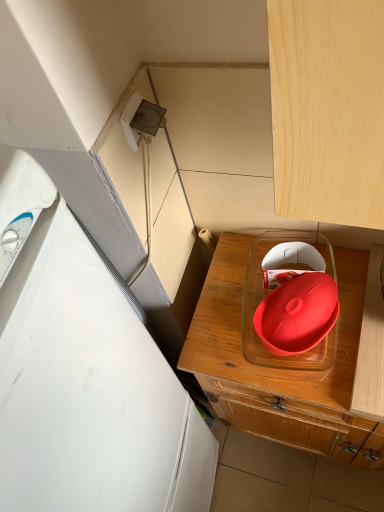
I want to click on free location to the left of rubberized red lid at center, so click(x=223, y=340).